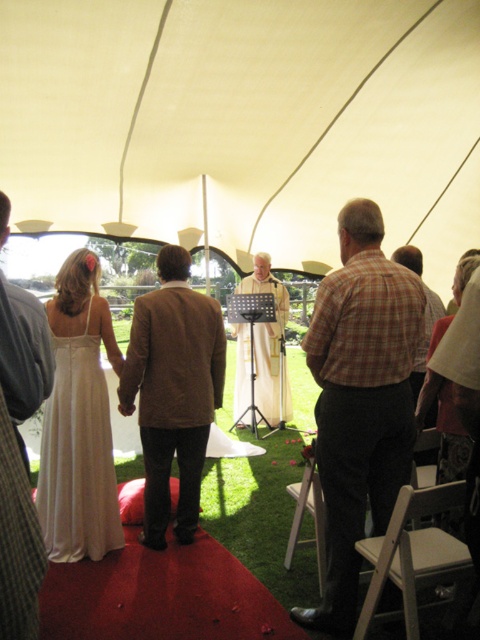
Describe the element at coordinates (244, 122) in the screenshot. I see `white fabric canopy at center` at that location.

Does point (251, 189) come farther from viewer compared to point (130, 365)?

That is True.

Locate an element on the screen. white fabric canopy at center is located at coordinates (244, 122).

Can you confirm if brown wool coat at center is taller than white silk dress at center?

No, brown wool coat at center is not taller than white silk dress at center.

Find the location of a particular element. brown wool coat at center is located at coordinates (17, 477).

Locate an element on the screen. brown wool coat at center is located at coordinates (17, 477).

Between white satin dress at left and brown wool coat at center, which one appears on the right side from the viewer's perspective?

brown wool coat at center

From the picture: Who is higher up, white satin dress at left or brown wool coat at center?

Positioned higher is brown wool coat at center.

The width and height of the screenshot is (480, 640). What do you see at coordinates (79, 440) in the screenshot?
I see `white satin dress at left` at bounding box center [79, 440].

You are a GUI agent. You are given a task and a screenshot of the screen. Output one action in this format:
    pyautogui.click(x=<x>, y=<y>)
    Task: Click on the white satin dress at left
    The height and width of the screenshot is (640, 480).
    Given the screenshot: What is the action you would take?
    (79, 440)